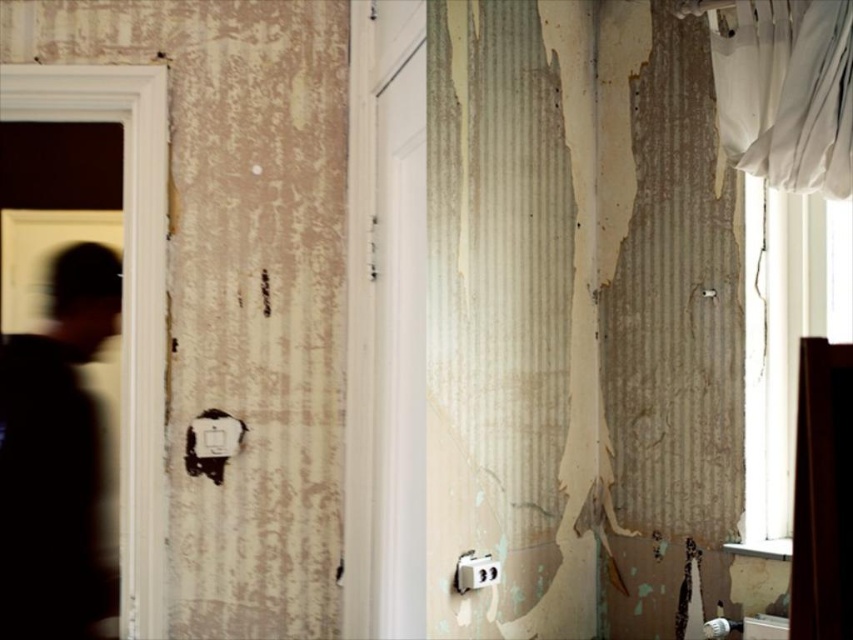
Does point (9, 582) lie behind point (751, 0)?

Yes, it is behind point (751, 0).

Is point (90, 540) positioned before point (790, 92)?

That is False.

Is point (77, 348) farther from viewer compared to point (840, 77)?

Yes, point (77, 348) is farther from viewer.

Locate an element on the screen. Image resolution: width=853 pixels, height=640 pixels. black matte person at left is located at coordinates 56,458.